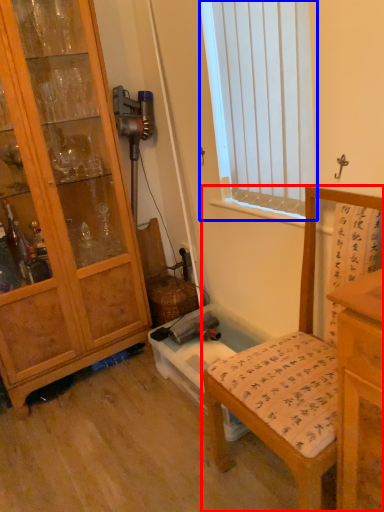
Question: Which point is closer to the camera, chair (highlighted by a red box) or window (highlighted by a blue box)?

Choices:
 (A) chair
 (B) window

Answer: (A)